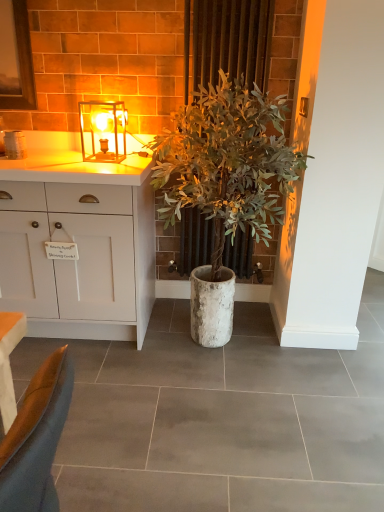
What are the coordinates of `vacant space positioned to the left of matte glass lamp at upper center` in the screenshot? It's located at tap(74, 158).